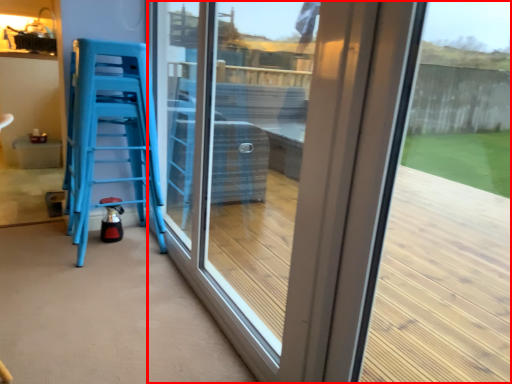
Question: From the image's perspective, what is the correct spatial relationship of window (annotated by the red box) in relation to furniture?

Choices:
 (A) above
 (B) below

Answer: (B)